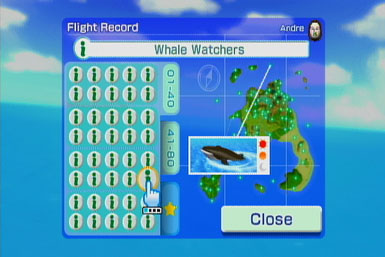
You are a GUI agent. You are given a task and a screenshot of the screen. Output one action in this format:
    pyautogui.click(x=<x>, y=<y>)
    Task: Click on the blue window
    
    Given the screenshot: What is the action you would take?
    pyautogui.click(x=208, y=25)